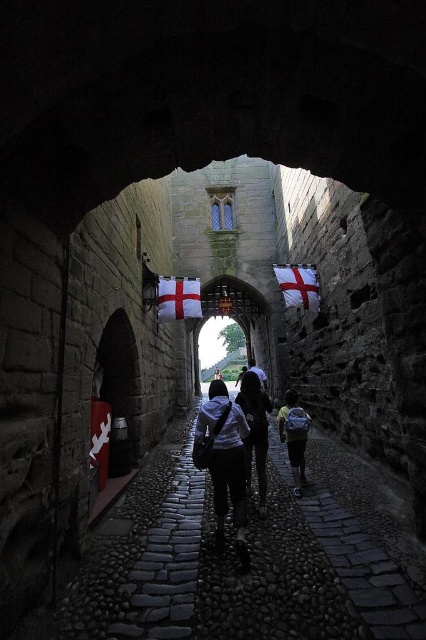
Question: Is light blue backpack at center positioned in front of white fabric flag at center?

Choices:
 (A) yes
 (B) no

Answer: (A)

Question: Among these objects, which one is farthest from the camera?

Choices:
 (A) dark gray fabric backpack at center
 (B) light blue backpack at center
 (C) dark stone path at center
 (D) white fabric at center

Answer: (D)

Question: Which point appears farthest from the camera in this image?

Choices:
 (A) (253, 362)
 (B) (301, 301)

Answer: (A)

Question: Is dark blue jeans at center wider than light blue backpack at center?

Choices:
 (A) yes
 (B) no

Answer: (B)

Question: Estimate the real-world distances between objects in this image. Which object is farther from the white fabric at center?

Choices:
 (A) dark gray fabric backpack at center
 (B) white cotton flag at upper center
 (C) dark blue jeans at center
 (D) dark stone path at center

Answer: (C)

Question: Is dark blue jeans at center behind white fabric flag at center?

Choices:
 (A) no
 (B) yes

Answer: (A)